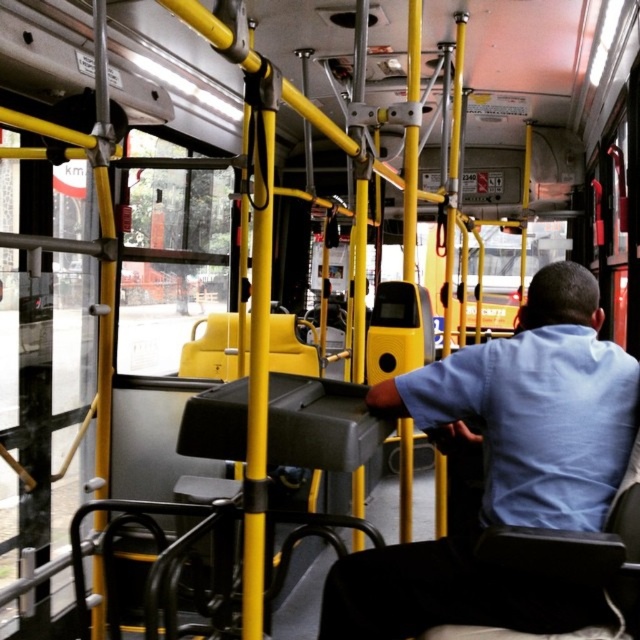
Is point (401, 547) closer to viewer compared to point (509, 490)?

No, it is not.

Which is below, blue cotton shirt at center or light blue cotton shirt at center?

blue cotton shirt at center

What do you see at coordinates (532, 406) in the screenshot?
I see `blue cotton shirt at center` at bounding box center [532, 406].

Where is `blue cotton shirt at center`? The height and width of the screenshot is (640, 640). blue cotton shirt at center is located at coordinates (532, 406).